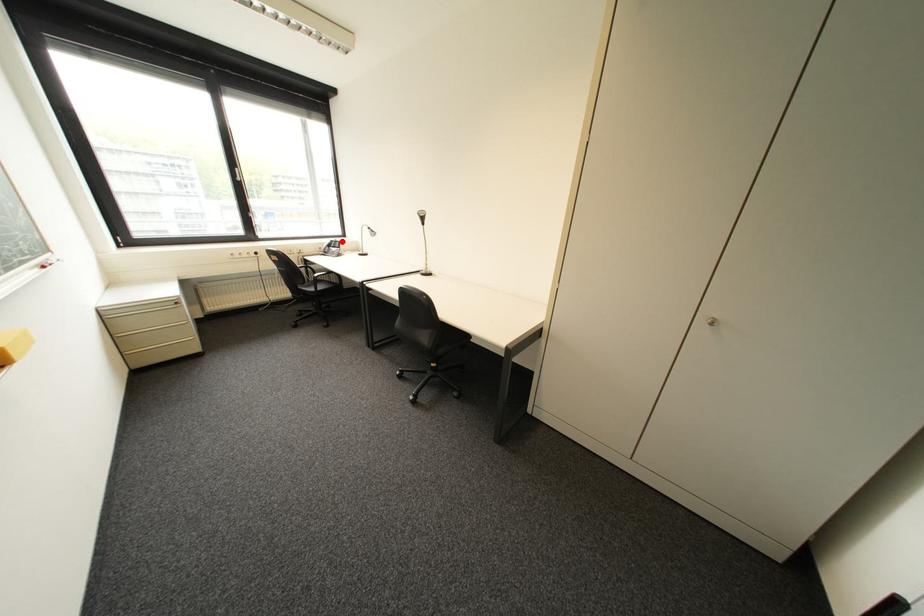
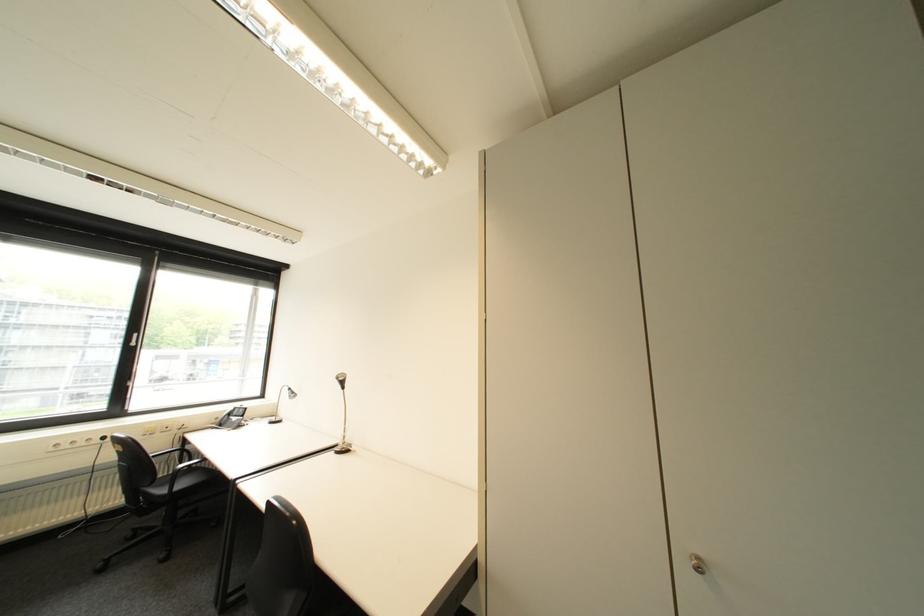
Question: I am providing you with two images of the same scene from different viewpoints. Given a red point in image1, look at the same physical point in image2. Is it:

Choices:
 (A) Closer to the viewpoint
 (B) Farther from the viewpoint

Answer: (B)